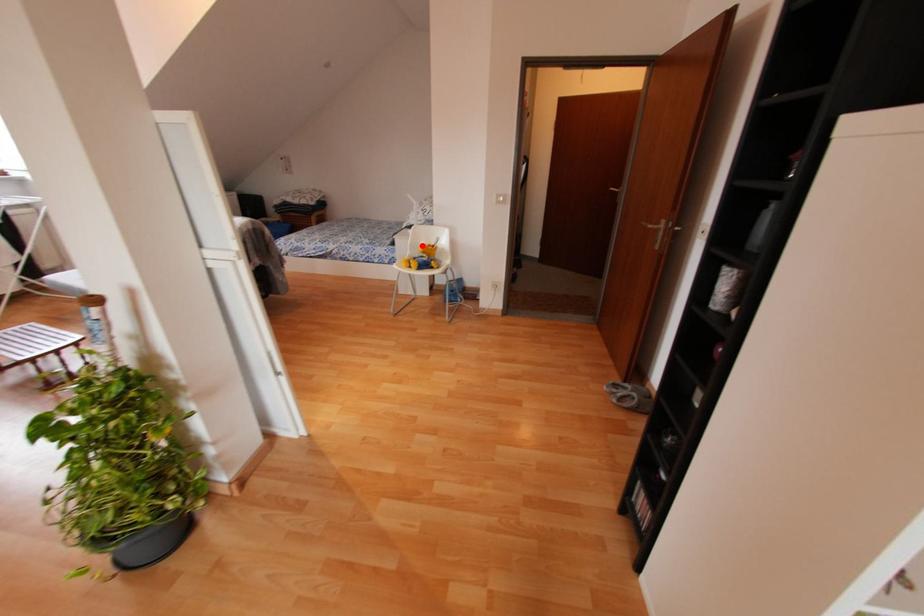
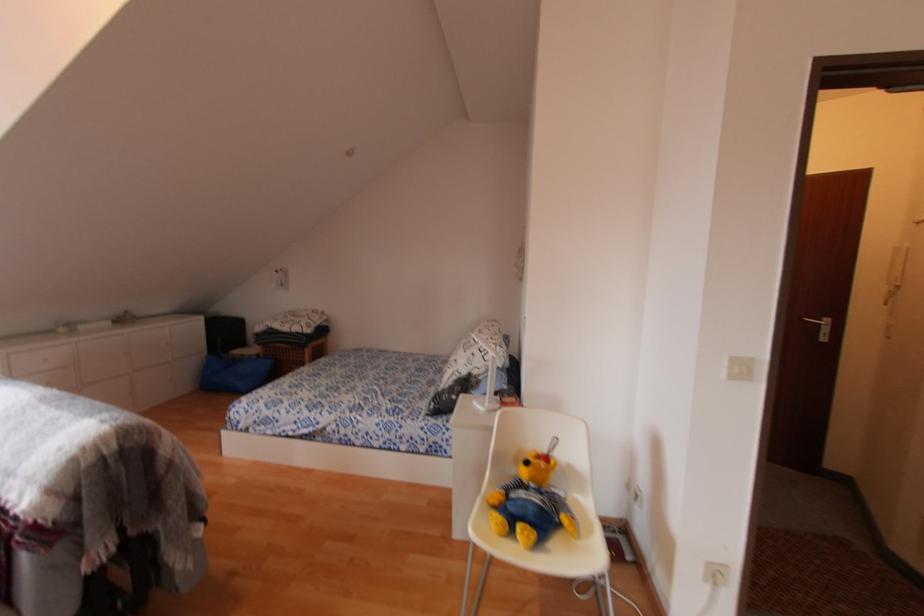
Question: I am providing you with two images of the same scene from different viewpoints. Given a red point in image1, look at the same physical point in image2. Is it:

Choices:
 (A) Closer to the viewpoint
 (B) Farther from the viewpoint

Answer: (B)